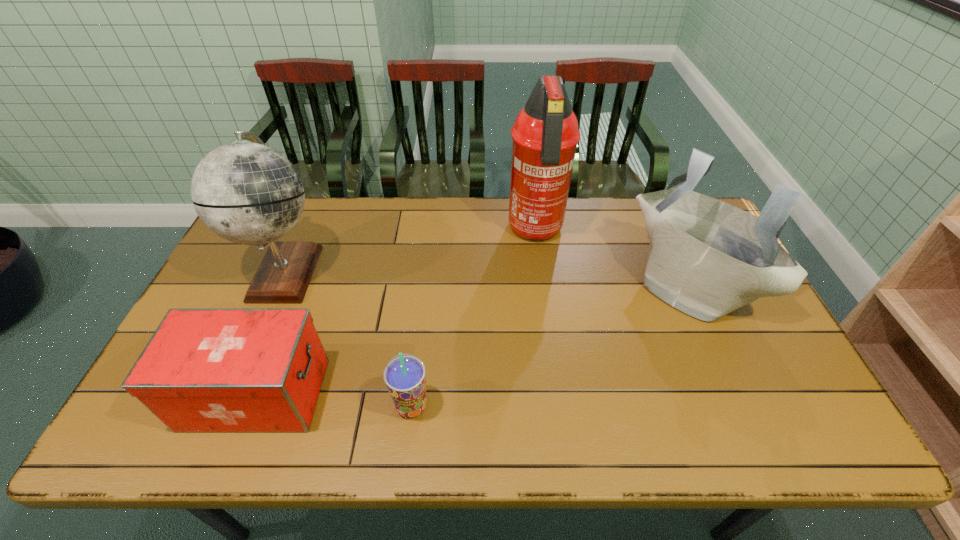
Find the location of `fire extinguisher`. fire extinguisher is located at coordinates (545, 135).

Where is `globe`? This screenshot has height=540, width=960. globe is located at coordinates (246, 192).

Find the location of `the rightmost object`. the rightmost object is located at coordinates point(707,258).

Where is `smoothie`? This screenshot has width=960, height=540. smoothie is located at coordinates (404, 375).

At what (x,y) coordinates should I click in order to perform the action: click on the first-aid kit. Please return your answer as a coordinate pair (x, y). Image resolution: width=960 pixels, height=540 pixels. Looking at the image, I should click on (204, 369).

Where is `free spot located on the trigger side of the fire extinguisher`? Image resolution: width=960 pixels, height=540 pixels. free spot located on the trigger side of the fire extinguisher is located at coordinates (540, 268).

Image resolution: width=960 pixels, height=540 pixels. Identify the location of vacant area situated at the equator of the globe. (348, 271).

You are a GUI agent. You are given a task and a screenshot of the screen. Output one action in this format:
    pyautogui.click(x=<x>, y=<y>)
    Task: Click on the vacant point located 0.270m on the left of the rightmost object
    This screenshot has height=540, width=960.
    Given the screenshot: What is the action you would take?
    pyautogui.click(x=540, y=284)

This screenshot has height=540, width=960. I want to click on free location located 0.400m on the left of the smoothie, so click(224, 406).

You are a GUI agent. You are given a task and a screenshot of the screen. Output one action in this format:
    pyautogui.click(x=<x>, y=<y>)
    Task: Click on the vacant point located 0.100m on the handle side of the first-aid kit
    
    Given the screenshot: What is the action you would take?
    pyautogui.click(x=365, y=394)